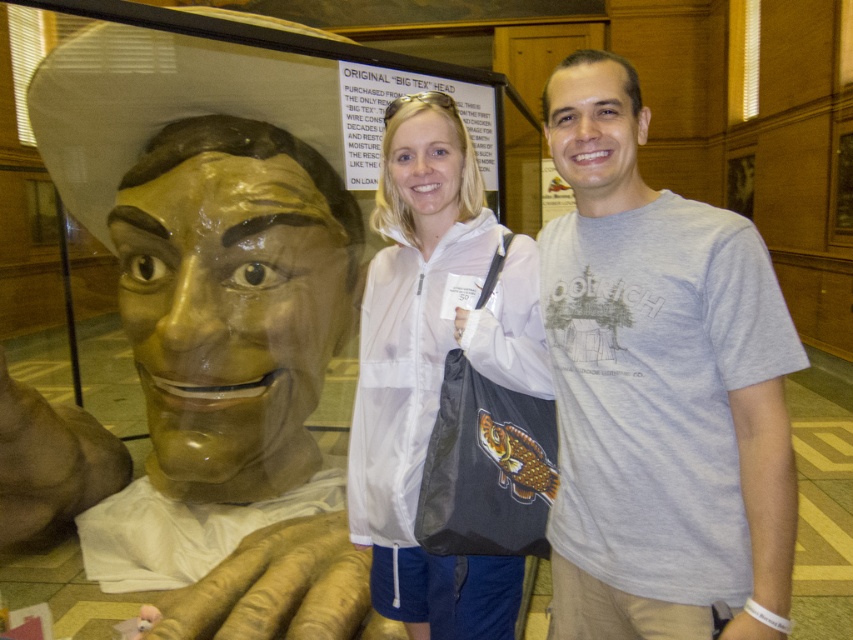
What is the clothing item at the coordinate point (659, 387) in the image?

The gray cotton t shirt at right is located at the coordinate point (659, 387).